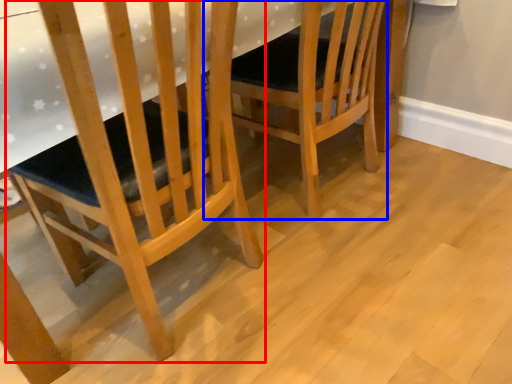
Question: Which object is further to the camera taking this photo, chair (highlighted by a red box) or chair (highlighted by a blue box)?

Choices:
 (A) chair
 (B) chair

Answer: (B)